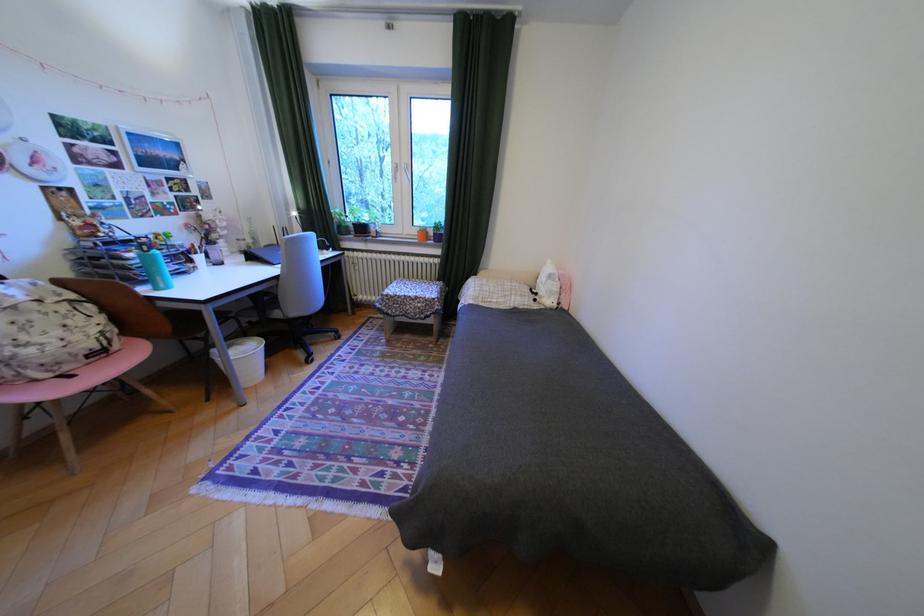
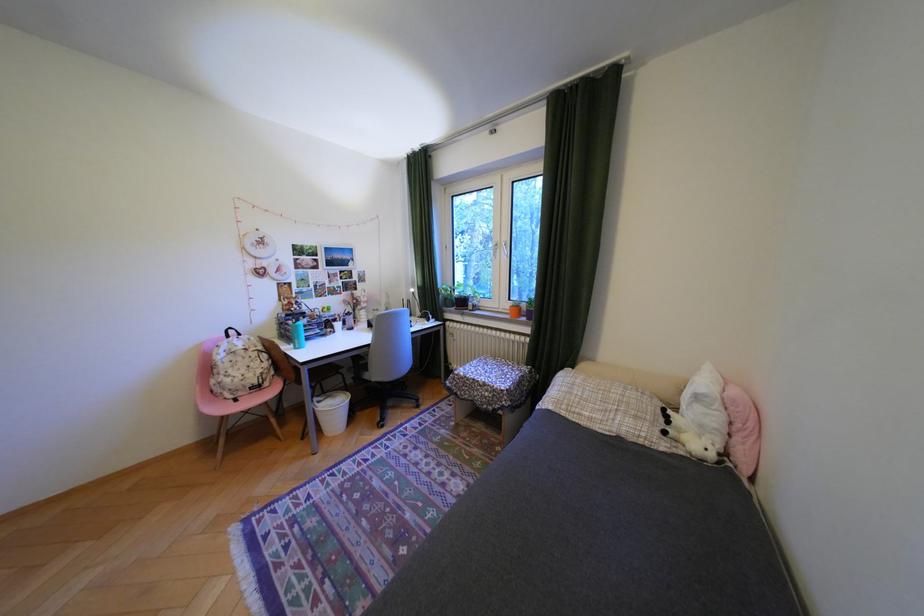
Where in the second image is the point corresponding to point 402,312 from the first image?

(470, 392)